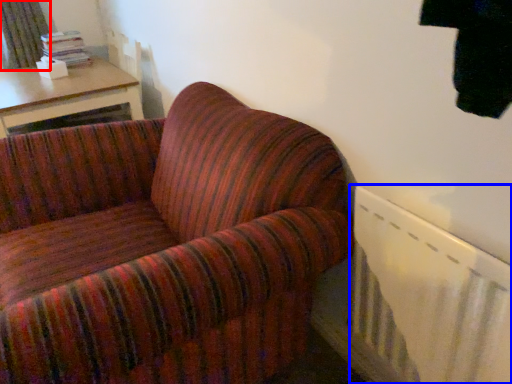
Question: Which object appears farthest to the camera in this image, curtain (highlighted by a red box) or radiator (highlighted by a blue box)?

Choices:
 (A) curtain
 (B) radiator

Answer: (A)